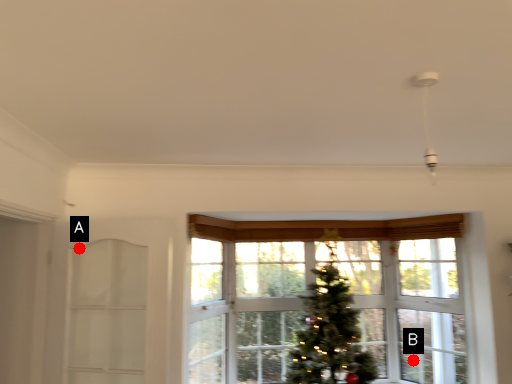
Question: Two points are circled on the image, labeled by A and B beside each circle. Among these points, which one is nearest to the camera?

Choices:
 (A) A is closer
 (B) B is closer

Answer: (A)